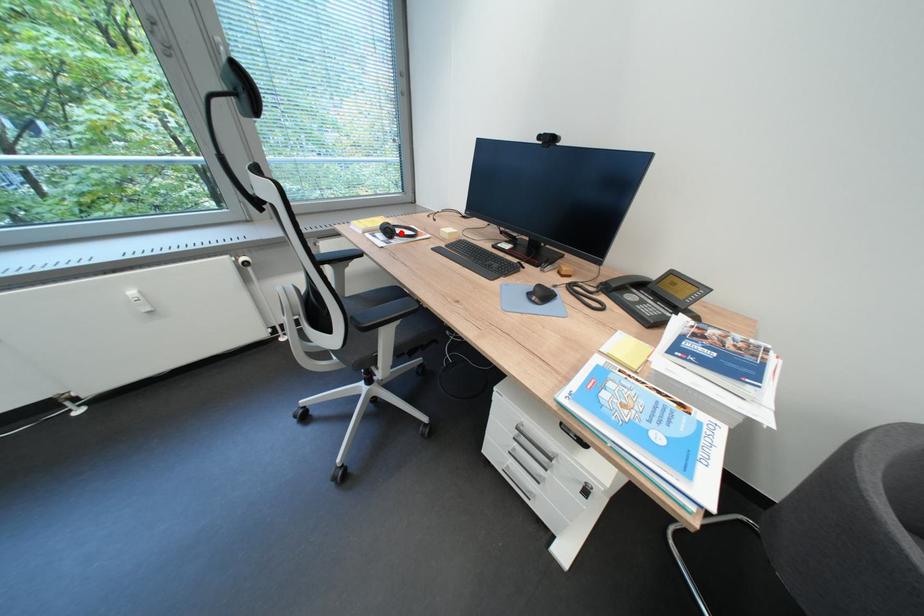
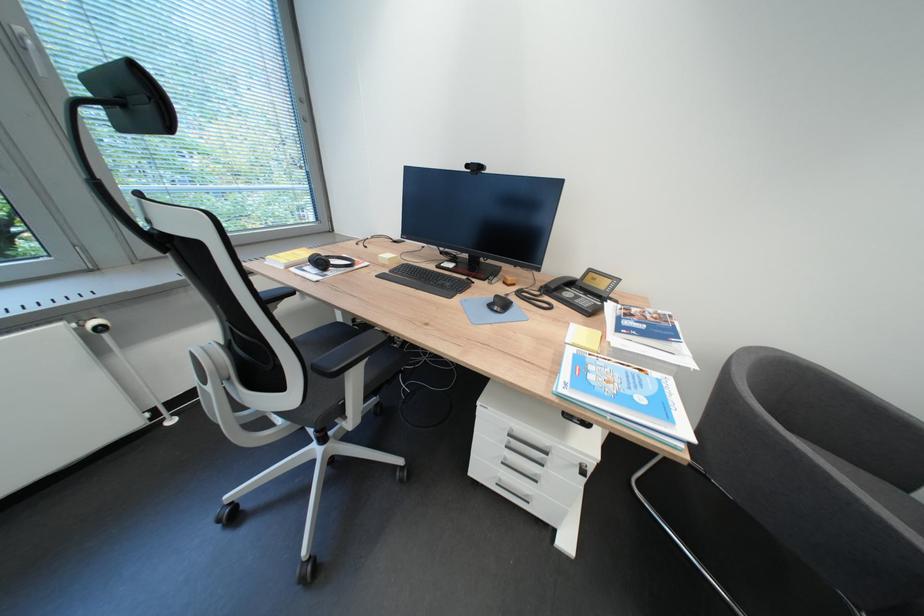
Find the pixel in the second image that matches the highlighted location in the first image.

(333, 265)